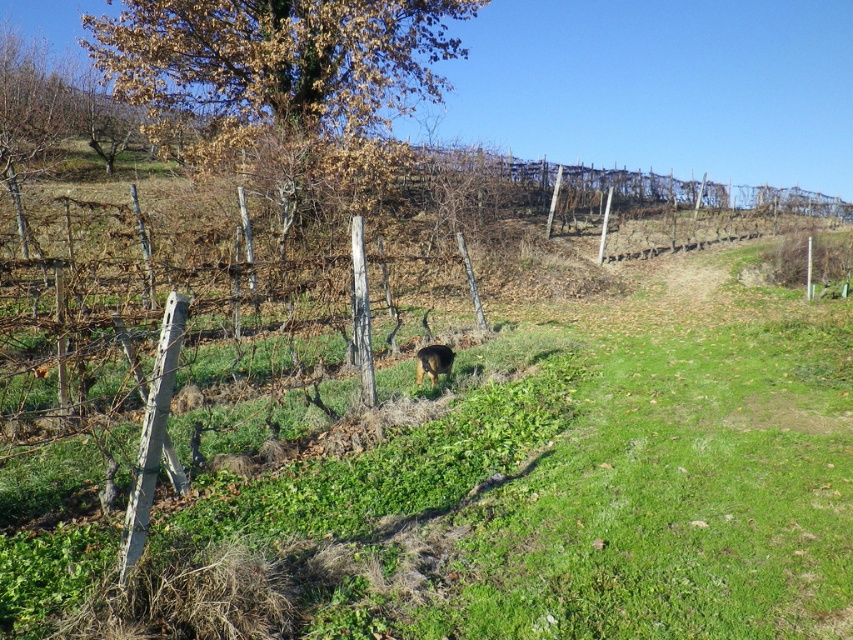
Which is behind, point (335, 12) or point (421, 364)?

The point (335, 12) is behind.

Is brown leafy tree at upper left bigger than brown furry dog at center?

Yes.

Find the location of `brown leafy tree at upper left`. brown leafy tree at upper left is located at coordinates (277, 58).